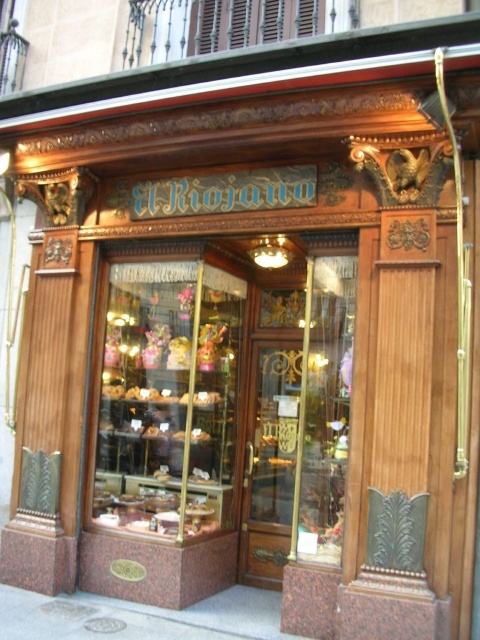
You are a customer standing outside the bakery entrance. You want to see the baked goods inside through the shiny glass display case at center. Can you see them through the gold polished wood door at center?

The shiny glass display case at center is located above the gold polished wood door at center, so you can see the baked goods through the shiny glass display case at center but not through the gold polished wood door at center since it is a solid wood door.